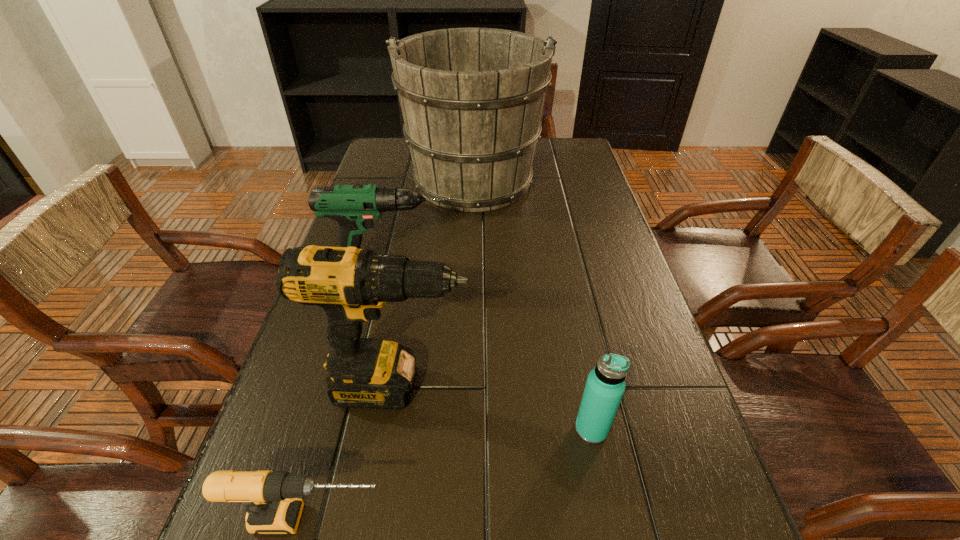
Where is `vacant space located 0.060m on the handle side of the farthest object`? This screenshot has width=960, height=540. vacant space located 0.060m on the handle side of the farthest object is located at coordinates (474, 139).

Identify the location of free location located 0.060m on the handle side of the farthest object. This screenshot has width=960, height=540. (474, 139).

Locate an element on the screen. Image resolution: width=960 pixels, height=540 pixels. vacant space located 0.150m at the tip of the third nearest object is located at coordinates (550, 386).

Find the location of a particular element. free spot located 0.100m on the handle side of the third shortest object is located at coordinates (495, 276).

Locate an element on the screen. The width and height of the screenshot is (960, 540). vacant space located 0.150m on the back of the fourth tallest object is located at coordinates (575, 348).

This screenshot has height=540, width=960. I want to click on free spot located 0.360m on the handle side of the nearest drill, so click(626, 518).

Locate an element on the screen. This screenshot has height=540, width=960. object that is positioned at the far edge is located at coordinates (472, 98).

Identify the location of bucket at the left edge. (472, 98).

You are a GUI agent. You are given a task and a screenshot of the screen. Output one action in this format:
    pyautogui.click(x=<x>, y=<y>)
    Task: Click on the object at the right edge
    Image resolution: width=960 pixels, height=540 pixels.
    Given the screenshot: What is the action you would take?
    pyautogui.click(x=605, y=385)

You are a GUI agent. You are given a task and a screenshot of the screen. Output one action in this format:
    pyautogui.click(x=<x>, y=<y>)
    Task: Click on the object that is at the far left corner
    This screenshot has width=960, height=540.
    Given the screenshot: What is the action you would take?
    pyautogui.click(x=472, y=98)